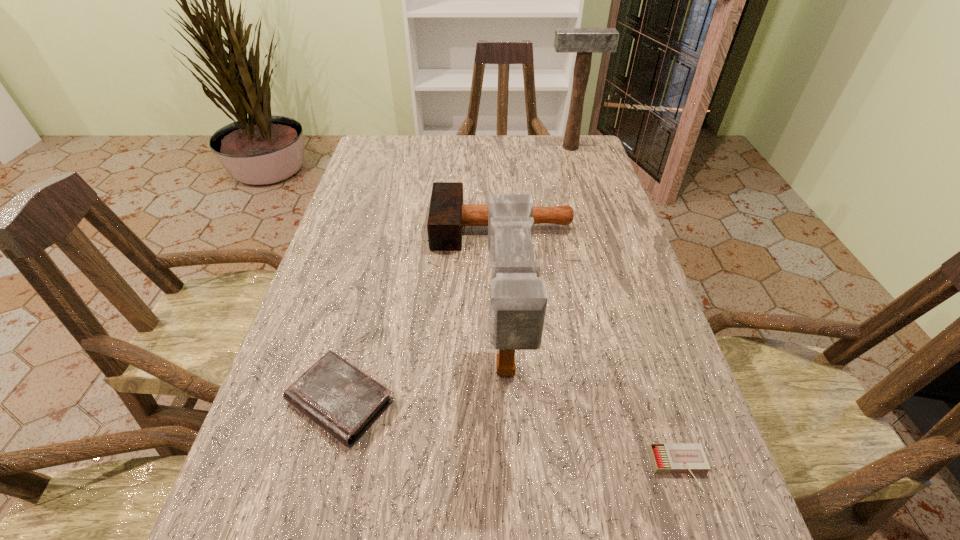
The height and width of the screenshot is (540, 960). I want to click on vacant space located 0.100m on the hammer head face of the third shortest object, so click(x=394, y=227).

The height and width of the screenshot is (540, 960). Find the location of `vacant point located 0.160m on the hammer head face of the third shortest object`. vacant point located 0.160m on the hammer head face of the third shortest object is located at coordinates (370, 227).

Locate an element on the screen. vacant space located on the right of the fourth tallest object is located at coordinates (492, 401).

The image size is (960, 540). I want to click on object that is at the far edge, so click(x=584, y=41).

At what (x,y) coordinates should I click in order to perform the action: click on object that is at the left edge. Please return your answer as a coordinate pair (x, y). Looking at the image, I should click on (337, 396).

You are a GUI agent. You are given a task and a screenshot of the screen. Output one action in this format:
    pyautogui.click(x=<x>, y=<y>)
    Task: Click on the matchbox situated at the right edge
    
    Given the screenshot: What is the action you would take?
    pyautogui.click(x=669, y=458)

I want to click on object present at the far right corner, so click(x=584, y=41).

The height and width of the screenshot is (540, 960). In the image, there is a desktop. Find the location of `vacant space at the far edge`. vacant space at the far edge is located at coordinates (455, 157).

I want to click on free space at the left edge of the desktop, so click(x=368, y=228).

Locate an element on the screen. This screenshot has height=540, width=960. vacant region at the right edge of the desktop is located at coordinates (612, 221).